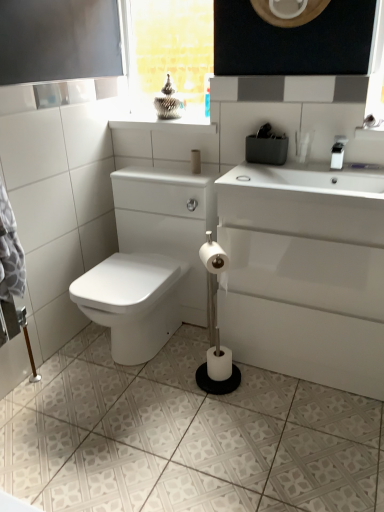
Locate an element on the screen. Image resolution: width=384 pixels, height=512 pixels. vacant space to the left of white matte toilet paper at center, the 1th toilet paper in the bottom-to-top sequence is located at coordinates (178, 380).